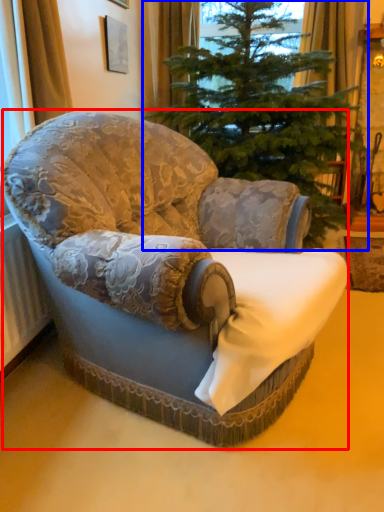
Question: Which of the following is the closest to the observer, chair (highlighted by a red box) or christmas tree (highlighted by a blue box)?

Choices:
 (A) chair
 (B) christmas tree

Answer: (A)